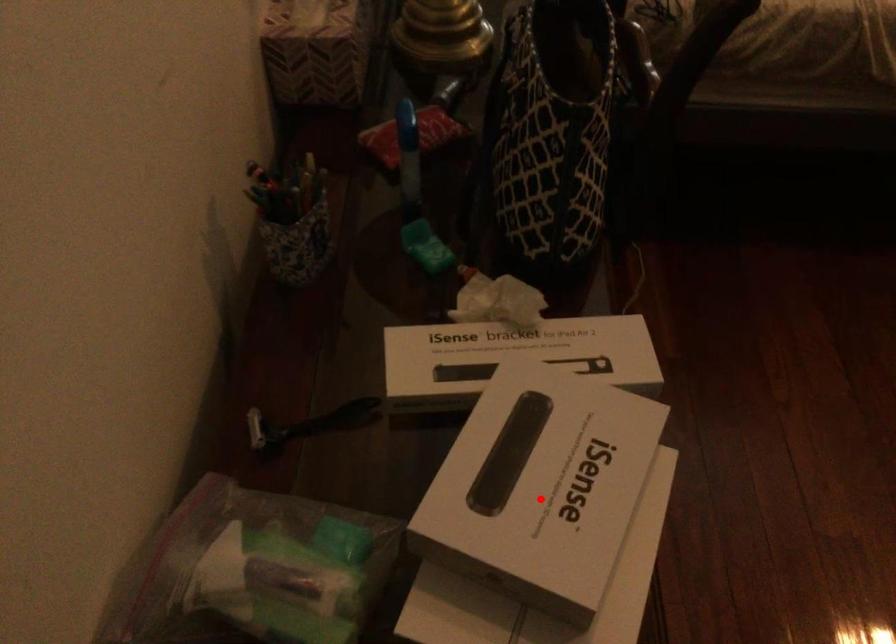
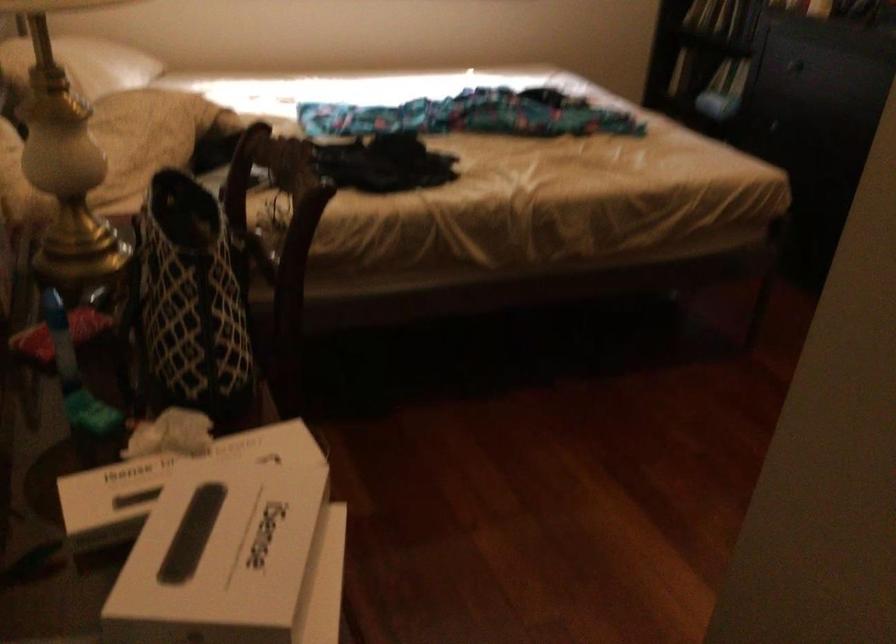
Question: I am providing you with two images of the same scene from different viewpoints. In image1, a red point is highlighted. Considering the same 3D point in image2, which of the following is correct?

Choices:
 (A) It is closer
 (B) It is farther

Answer: (B)